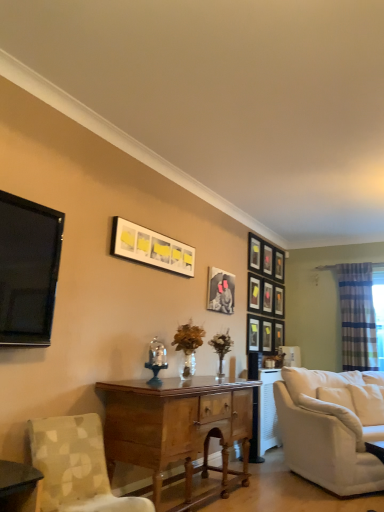
Question: From a real-world perspective, is wooden desk at center physically located above or below matte black picture frame at upper center, which appears as the 11th picture frame when viewed from the left?

Choices:
 (A) below
 (B) above

Answer: (A)

Question: Considering the relative positions of wooden desk at center and matte black picture frame at upper center, which appears as the 11th picture frame when viewed from the left, in the image provided, is wooden desk at center to the left or to the right of matte black picture frame at upper center, which appears as the 11th picture frame when viewed from the left,?

Choices:
 (A) right
 (B) left

Answer: (B)

Question: Estimate the real-world distances between objects in this image. Which object is closer to the wooden desk at center?

Choices:
 (A) matte black picture frame at center, the third picture frame from the left
 (B) matte black picture frame at upper center, which appears as the 11th picture frame when viewed from the left
 (C) striped fabric curtain at right
 (D) matte black picture frame at upper center, which ranks as the 11th picture frame in right-to-left order
 (E) black glossy tv at left

Answer: (E)

Question: Which object is the closest to the matte black picture frame at upper center, placed as the third picture frame when sorted from right to left?

Choices:
 (A) white fabric couch at right
 (B) matte black picture frame at upper right, which is counted as the 7th picture frame, starting from the right
 (C) matte black picture frame at center-right, which appears as the 6th picture frame when viewed from the left
 (D) white soft cushion at lower right
 (E) matte black picture frame at upper right, the 7th picture frame from the left

Answer: (C)